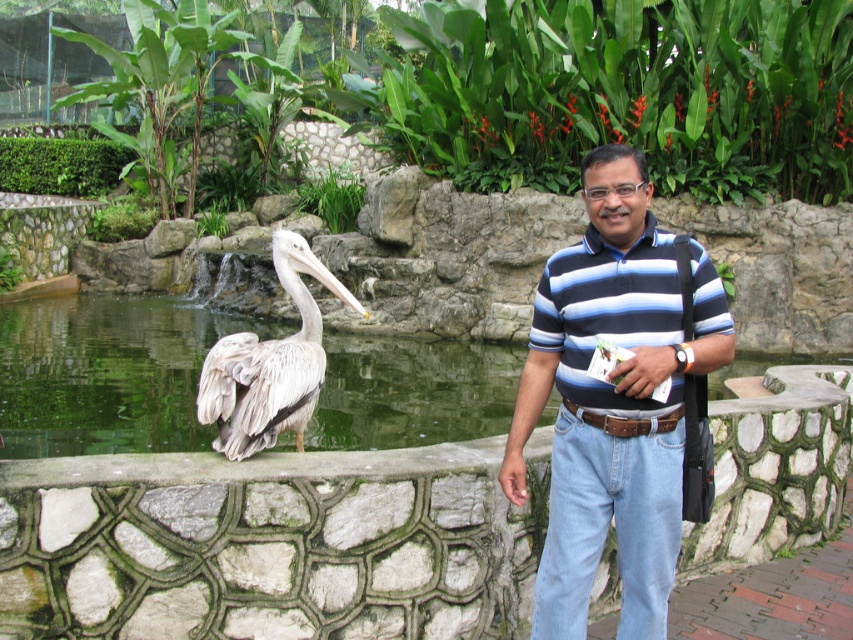
Does blue striped polo shirt at center have a greater height compared to white feathered pelican at center?

Indeed, blue striped polo shirt at center has a greater height compared to white feathered pelican at center.

Is blue striped polo shirt at center above white feathered pelican at center?

Incorrect, blue striped polo shirt at center is not positioned above white feathered pelican at center.

Measure the distance between point (657, 342) and camera.

A distance of 10.94 feet exists between point (657, 342) and camera.

This screenshot has width=853, height=640. Identify the location of blue striped polo shirt at center. (613, 401).

Is point (663, 490) more distant than point (630, 412)?

Yes.

Which is behind, point (535, 326) or point (556, 304)?

Point (535, 326)

Between point (585, 244) and point (659, 342), which one is positioned behind?

The point (585, 244) is behind.

The height and width of the screenshot is (640, 853). I want to click on blue striped polo shirt at center, so click(x=613, y=401).

Describe the element at coordinates (608, 314) in the screenshot. The width and height of the screenshot is (853, 640). I see `blue striped polo shirt at right` at that location.

Image resolution: width=853 pixels, height=640 pixels. What do you see at coordinates (608, 314) in the screenshot? I see `blue striped polo shirt at right` at bounding box center [608, 314].

The image size is (853, 640). In order to click on blue striped polo shirt at right in this screenshot , I will do `click(608, 314)`.